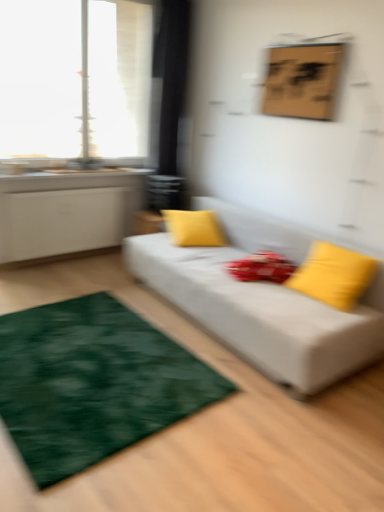
Question: Is transparent glass window at upper left bigger than yellow fabric pillow at center, which is counted as the 2th pillow, starting from the right?

Choices:
 (A) yes
 (B) no

Answer: (A)

Question: From a real-world perspective, is transparent glass window at upper left located beneath yellow fabric pillow at center, the first pillow positioned from the back?

Choices:
 (A) no
 (B) yes

Answer: (A)

Question: From a real-world perspective, is transparent glass window at upper left over yellow fabric pillow at center, the first pillow when ordered from left to right?

Choices:
 (A) no
 (B) yes

Answer: (B)

Question: Can you confirm if transparent glass window at upper left is positioned to the right of yellow fabric pillow at center, which is counted as the second pillow, starting from the front?

Choices:
 (A) yes
 (B) no

Answer: (B)

Question: Is transparent glass window at upper left far from yellow fabric pillow at center, which is counted as the second pillow, starting from the front?

Choices:
 (A) yes
 (B) no

Answer: (A)

Question: Would you say transparent glass window at upper left is inside or outside yellow fabric pillow at center, the first pillow positioned from the back?

Choices:
 (A) outside
 (B) inside

Answer: (A)

Question: In terms of width, does transparent glass window at upper left look wider or thinner when compared to yellow fabric pillow at center, the first pillow when ordered from left to right?

Choices:
 (A) wide
 (B) thin

Answer: (B)

Question: Based on their positions, is transparent glass window at upper left located to the left or right of yellow fabric pillow at center, which is counted as the second pillow, starting from the front?

Choices:
 (A) left
 (B) right

Answer: (A)

Question: From the image's perspective, is transparent glass window at upper left positioned above or below yellow fabric pillow at center, the first pillow when ordered from left to right?

Choices:
 (A) below
 (B) above

Answer: (B)

Question: Considering the positions of point (87, 116) and point (364, 285), is point (87, 116) closer or farther from the camera than point (364, 285)?

Choices:
 (A) closer
 (B) farther

Answer: (B)

Question: Relative to yellow matte pillow at right, placed as the second pillow when sorted from back to front, is transparent glass window at upper left in front or behind?

Choices:
 (A) behind
 (B) front

Answer: (A)

Question: In terms of width, does transparent glass window at upper left look wider or thinner when compared to yellow matte pillow at right, placed as the second pillow when sorted from back to front?

Choices:
 (A) thin
 (B) wide

Answer: (A)

Question: From the image's perspective, relative to yellow matte pillow at right, which is the second pillow in left-to-right order, is transparent glass window at upper left above or below?

Choices:
 (A) above
 (B) below

Answer: (A)

Question: Relative to white fabric couch at center, is yellow fabric pillow at center, which is counted as the second pillow, starting from the front, in front or behind?

Choices:
 (A) front
 (B) behind

Answer: (B)

Question: From a real-world perspective, is yellow fabric pillow at center, the first pillow positioned from the back, positioned above or below white fabric couch at center?

Choices:
 (A) below
 (B) above

Answer: (B)